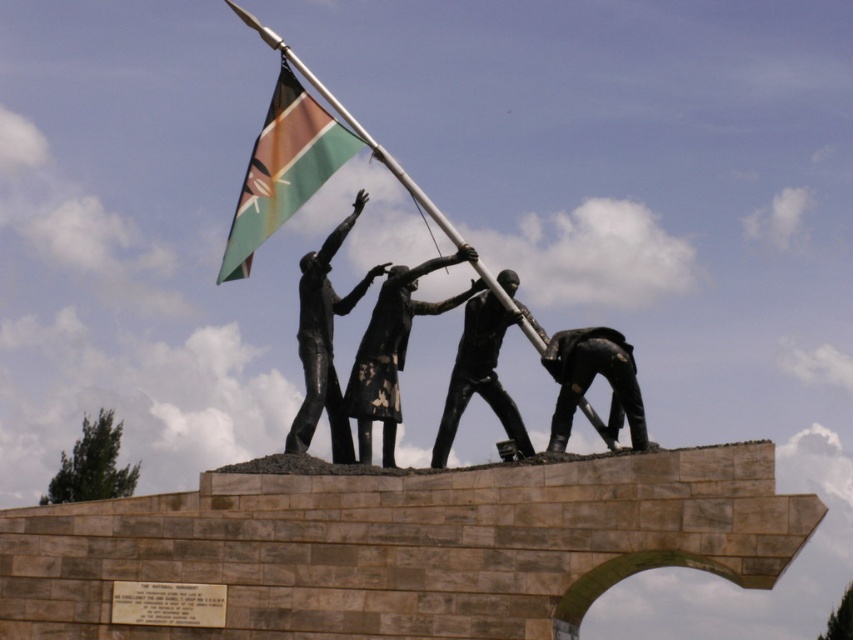
Is point (227, 253) positioned before point (485, 292)?

No, (227, 253) is behind (485, 292).

Which of these two, green and brown painted flag at center or black matte statue at center, stands shorter?

black matte statue at center is shorter.

Who is more distant from viewer, (305, 160) or (456, 360)?

Positioned behind is point (305, 160).

This screenshot has width=853, height=640. Find the location of `green and brown painted flag at center`. green and brown painted flag at center is located at coordinates (283, 168).

Which of these two, green and brown painted flag at center or black polished statue at center, stands taller?

With more height is green and brown painted flag at center.

This screenshot has width=853, height=640. I want to click on green and brown painted flag at center, so click(283, 168).

In order to click on green and brown painted flag at center in this screenshot , I will do `click(283, 168)`.

Between point (331, 321) and point (489, 371), which one is positioned in front?

Point (489, 371) is in front.

Based on the photo, can you confirm if black polished statue at center is positioned to the left of black matte statue at center?

Yes, black polished statue at center is to the left of black matte statue at center.

Which is behind, point (310, 340) or point (453, 420)?

Positioned behind is point (453, 420).

Locate an element on the screen. This screenshot has width=853, height=640. black polished statue at center is located at coordinates (323, 342).